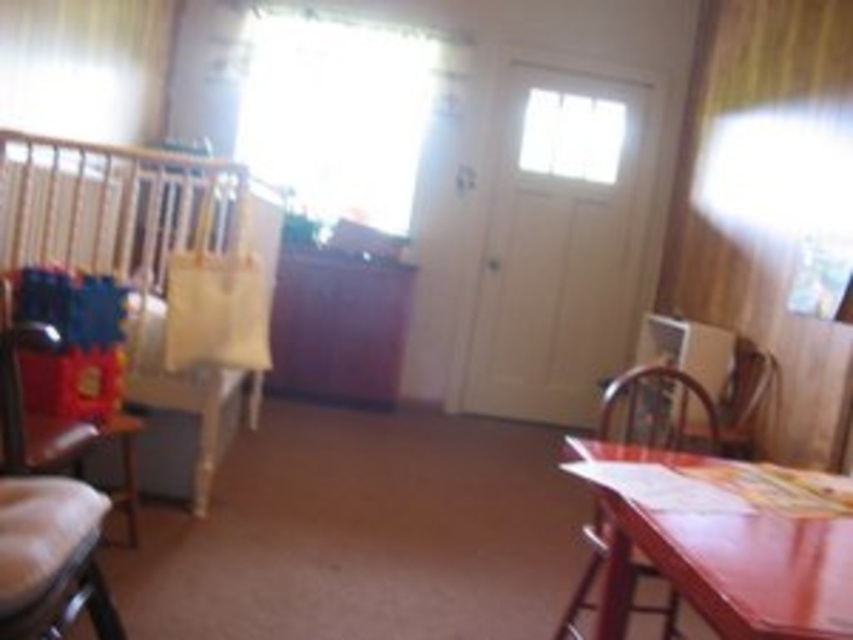
Question: Does wooden table at lower right lie in front of brown leather armchair at right?

Choices:
 (A) no
 (B) yes

Answer: (B)

Question: Can you confirm if wooden table at lower right is positioned to the right of brown leather armchair at right?

Choices:
 (A) no
 (B) yes

Answer: (A)

Question: Which is nearer to the white sheer curtain at upper left?

Choices:
 (A) wooden table at lower right
 (B) brown leather armchair at right
 (C) wooden chair at right
 (D) wooden paneling at upper right

Answer: (C)

Question: Estimate the real-world distances between objects in this image. Which object is closer to the wooden table at lower right?

Choices:
 (A) white sheer curtain at upper left
 (B) wooden paneling at upper right
 (C) wooden chair at right
 (D) brown leather armchair at right

Answer: (C)

Question: Which object appears farthest from the camera in this image?

Choices:
 (A) wooden table at lower right
 (B) wooden chair at right

Answer: (B)

Question: Considering the relative positions of wooden paneling at upper right and wooden table at lower right in the image provided, where is wooden paneling at upper right located with respect to wooden table at lower right?

Choices:
 (A) above
 (B) below

Answer: (A)